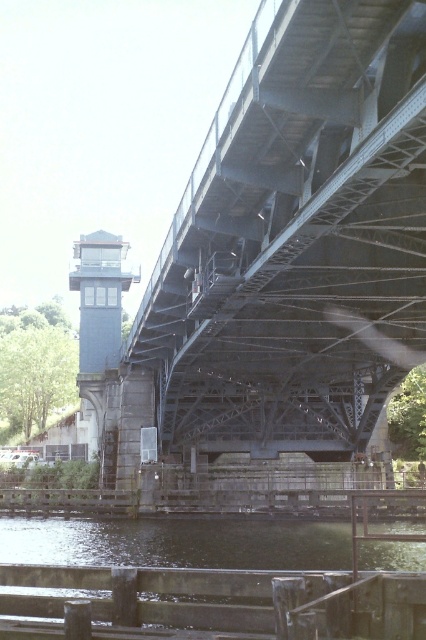
Question: Is metallic gray bridge at center smaller than dark green concrete river at lower center?

Choices:
 (A) yes
 (B) no

Answer: (B)

Question: Which point is closer to the camera?

Choices:
 (A) (394, 371)
 (B) (313, 616)

Answer: (B)

Question: Which point is closer to the camera?

Choices:
 (A) dark green concrete river at lower center
 (B) metallic gray bridge at center

Answer: (A)

Question: Can you confirm if metallic gray bridge at center is positioned above dark green concrete river at lower center?

Choices:
 (A) yes
 (B) no

Answer: (A)

Question: Can you confirm if metallic gray bridge at center is positioned to the left of dark green concrete river at lower center?

Choices:
 (A) yes
 (B) no

Answer: (B)

Question: Which point appears closest to the camera in this image?

Choices:
 (A) (238, 385)
 (B) (169, 620)

Answer: (B)